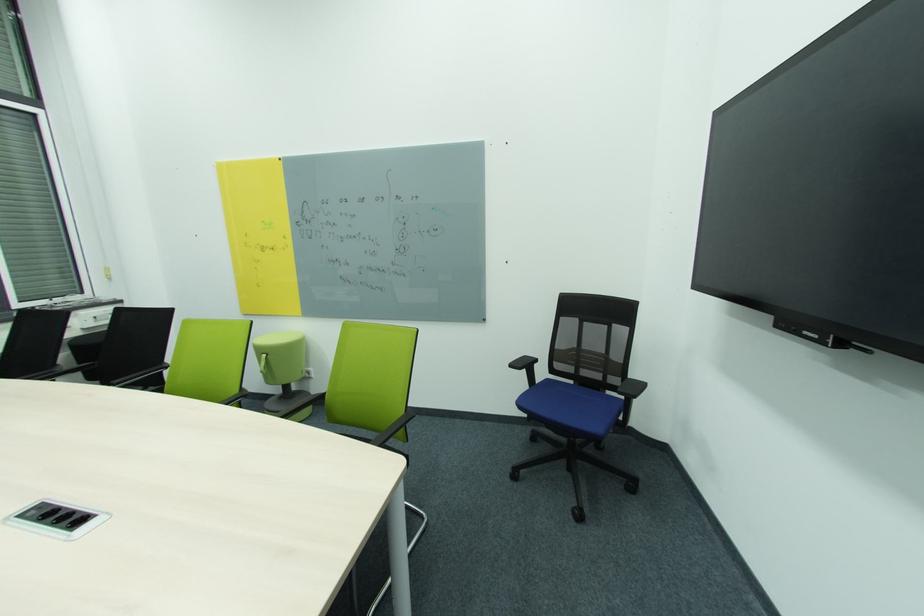
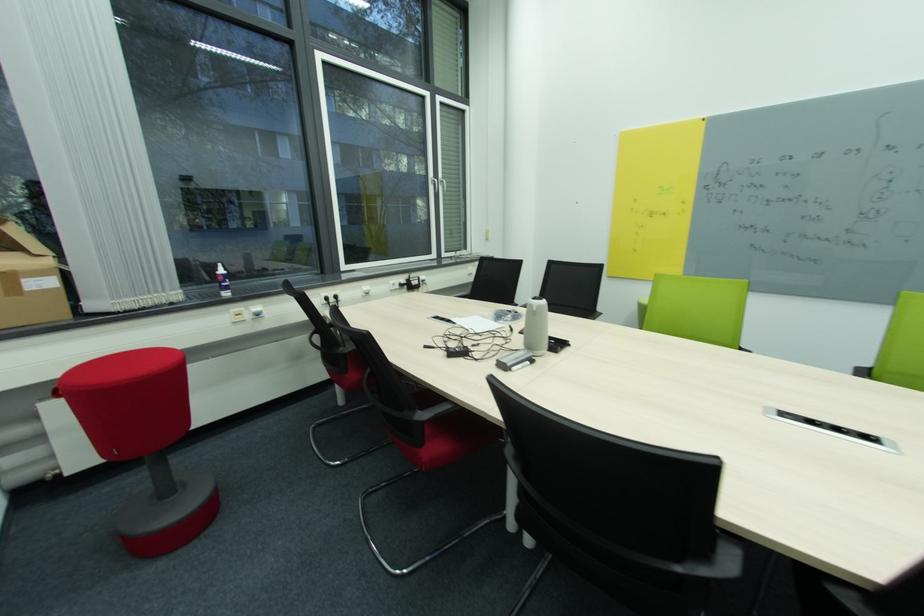
Question: What movement of the cameraman would produce the second image?

Choices:
 (A) Left
 (B) Right
 (C) Forward
 (D) Backward

Answer: (A)